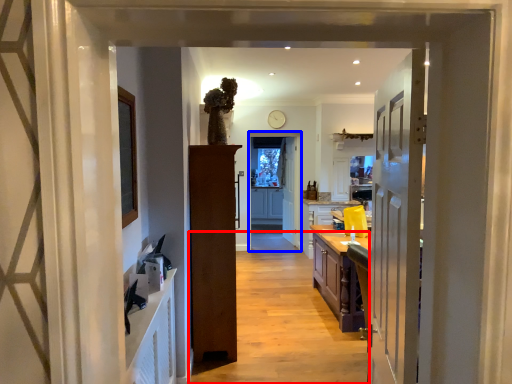
Question: Which object appears closest to the camera in this image, path (highlighted by a red box) or screen door (highlighted by a blue box)?

Choices:
 (A) path
 (B) screen door

Answer: (A)